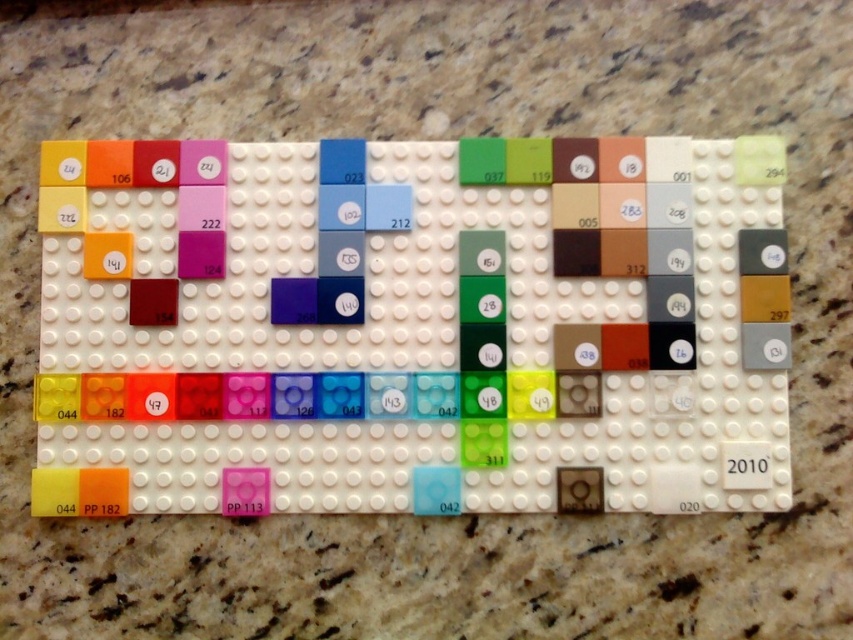
Is point (769, 445) positioned before point (439, 493)?

No, (769, 445) is behind (439, 493).

You are a GUI agent. You are given a task and a screenshot of the screen. Output one action in this format:
    pyautogui.click(x=<x>, y=<y>)
    Task: Click on the white plastic number at center
    The width and height of the screenshot is (853, 640).
    Given the screenshot: What is the action you would take?
    pyautogui.click(x=746, y=465)

Which of these two, matte pink square at center or matte green square at center, stands shorter?

With less height is matte pink square at center.

Is matte pink square at center bigger than matte green square at center?

Actually, matte pink square at center might be smaller than matte green square at center.

Is point (202, 195) behind point (486, 269)?

Yes.

Locate an element on the screen. matte pink square at center is located at coordinates (201, 208).

In the scene shown: Can you confirm if matte blue square at bottom center is bigger than matte blue square at center?

Incorrect, matte blue square at bottom center is not larger than matte blue square at center.

Who is positioned more to the left, matte blue square at bottom center or matte blue square at center?

matte blue square at center is more to the left.

What do you see at coordinates (434, 490) in the screenshot? This screenshot has height=640, width=853. I see `matte blue square at bottom center` at bounding box center [434, 490].

Locate an element on the screen. Image resolution: width=853 pixels, height=640 pixels. matte blue square at bottom center is located at coordinates (434, 490).